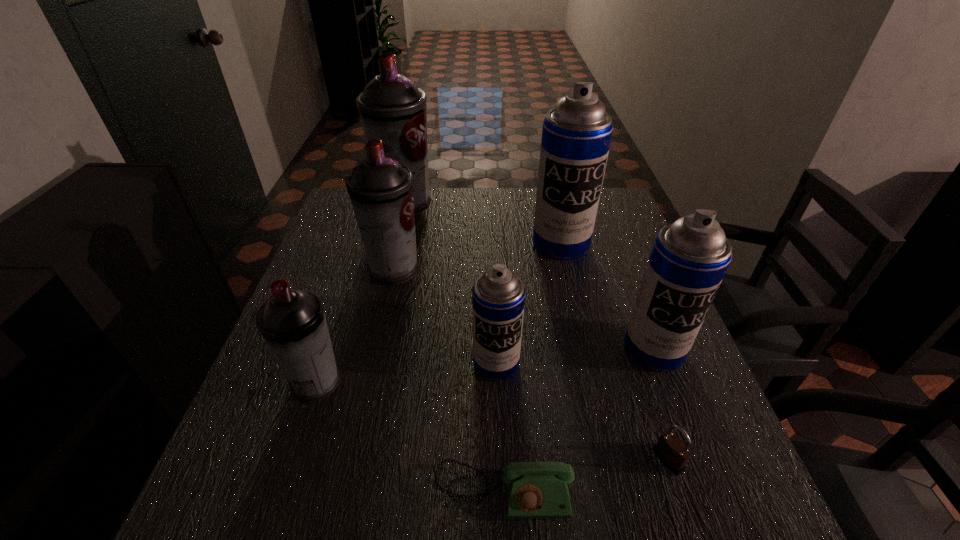
Identify the location of aerosol can that stands as the fifth closest to the nearest gray aerosol can. (689, 258).

At what (x,y) coordinates should I click in order to perform the action: click on gray aerosol can that is the third closest one to the rightmost blue aerosol can. Please return your answer as a coordinate pair (x, y). The width and height of the screenshot is (960, 540). Looking at the image, I should click on (392, 109).

Choose which gray aerosol can is the nearest neighbor to the second biggest gray aerosol can. Please provide its 2D coordinates. Your answer should be formatted as a tuple, i.e. [(x, y)], where the tuple contains the x and y coordinates of a point satisfying the conditions above.

[(392, 109)]

Locate which blue aerosol can ranks second in proximity to the biggest blue aerosol can. Please provide its 2D coordinates. Your answer should be formatted as a tuple, i.e. [(x, y)], where the tuple contains the x and y coordinates of a point satisfying the conditions above.

[(498, 296)]

This screenshot has width=960, height=540. Identify the location of the second closest blue aerosol can relative to the telephone. (689, 258).

Where is `free location that satisfies the following two spatial constraints: 1. on the front side of the second smallest gray aerosol can; 2. on the left side of the padlock`? The height and width of the screenshot is (540, 960). free location that satisfies the following two spatial constraints: 1. on the front side of the second smallest gray aerosol can; 2. on the left side of the padlock is located at coordinates (350, 460).